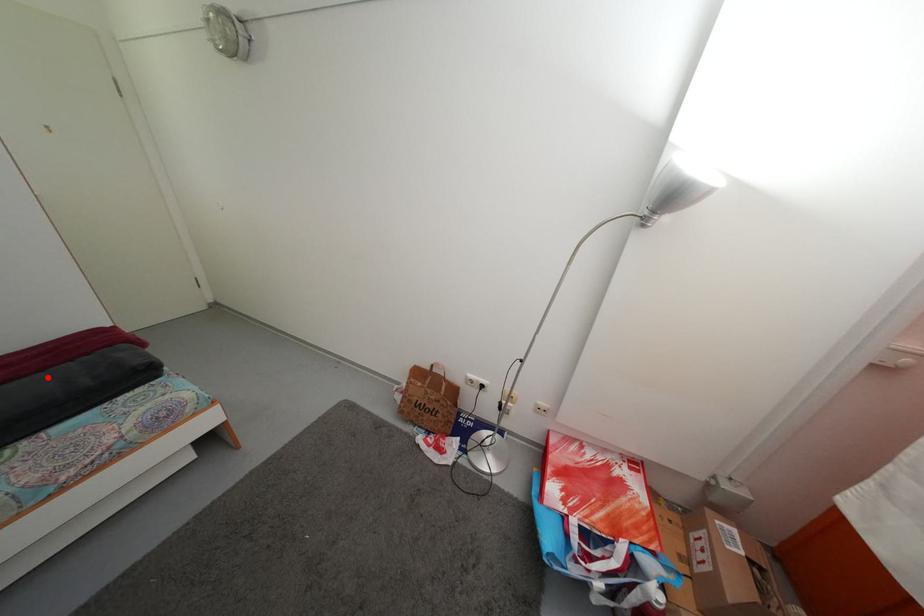
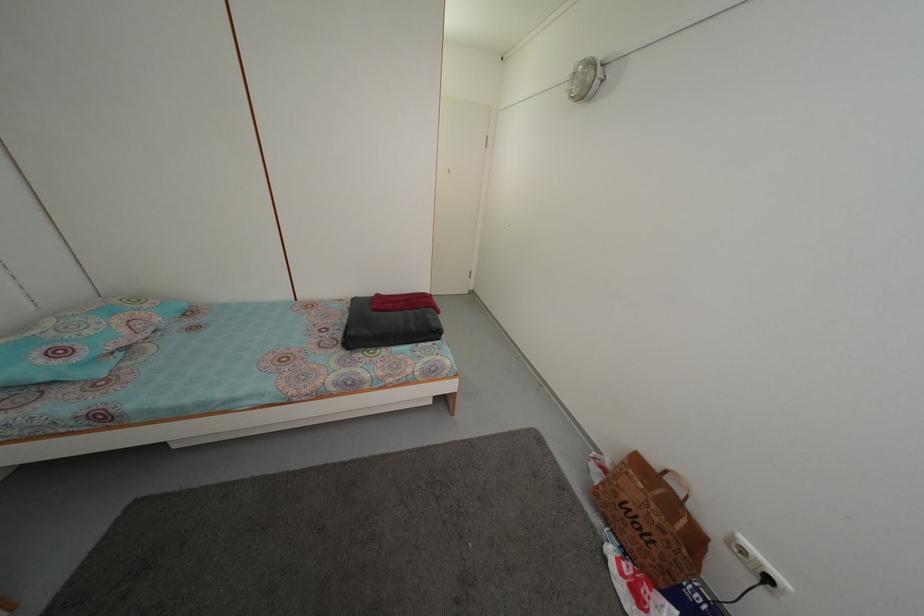
Where in the second image is the point corresponding to the highlighted location from the first image?

(407, 317)